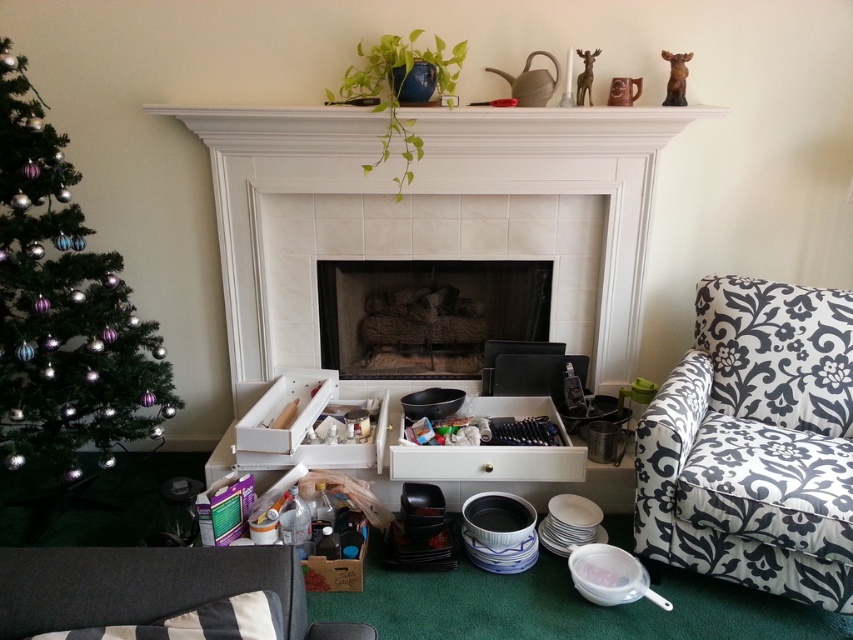
Question: Estimate the real-world distances between objects in this image. Which object is farther from the dark gray fabric couch at lower left?

Choices:
 (A) green matte christmas tree at left
 (B) black floral fabric armchair at right

Answer: (B)

Question: Can you confirm if black floral fabric armchair at right is positioned below dark gray fabric couch at lower left?

Choices:
 (A) no
 (B) yes

Answer: (A)

Question: Based on their relative distances, which object is farther from the black floral fabric armchair at right?

Choices:
 (A) dark gray fabric couch at lower left
 (B) green matte christmas tree at left

Answer: (B)

Question: Does black floral fabric armchair at right have a smaller size compared to green matte christmas tree at left?

Choices:
 (A) yes
 (B) no

Answer: (A)

Question: Which point is closer to the camera?

Choices:
 (A) (22, 456)
 (B) (167, 636)

Answer: (B)

Question: Is green matte christmas tree at left positioned behind dark gray fabric couch at lower left?

Choices:
 (A) yes
 (B) no

Answer: (A)